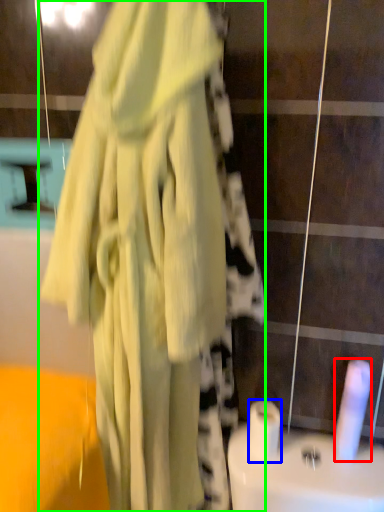
Question: Considering the real-world distances, which object is farthest from toilet paper (highlighted by a red box)? toilet paper (highlighted by a blue box) or fancy dress (highlighted by a green box)?

Choices:
 (A) toilet paper
 (B) fancy dress

Answer: (B)